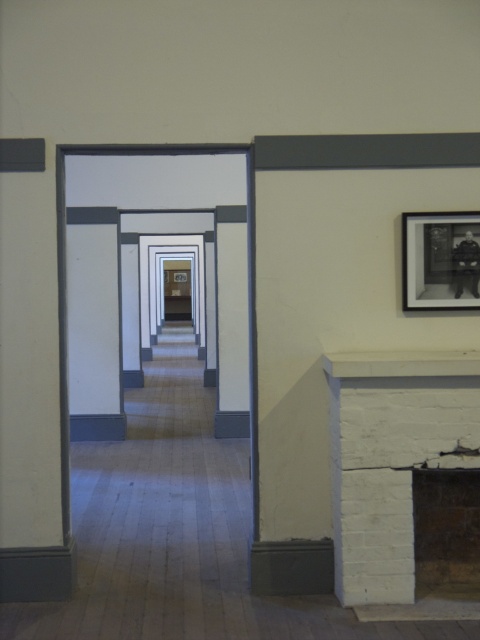
Does white painted brick fireplace at lower right have a lesser height compared to black matte picture frame at upper right?

No.

Who is higher up, white painted brick fireplace at lower right or black matte picture frame at upper right?

black matte picture frame at upper right is above.

Between point (431, 353) and point (454, 282), which one is positioned in front?

Point (431, 353) is in front.

Where is `white painted brick fireplace at lower right`? The width and height of the screenshot is (480, 640). white painted brick fireplace at lower right is located at coordinates (392, 458).